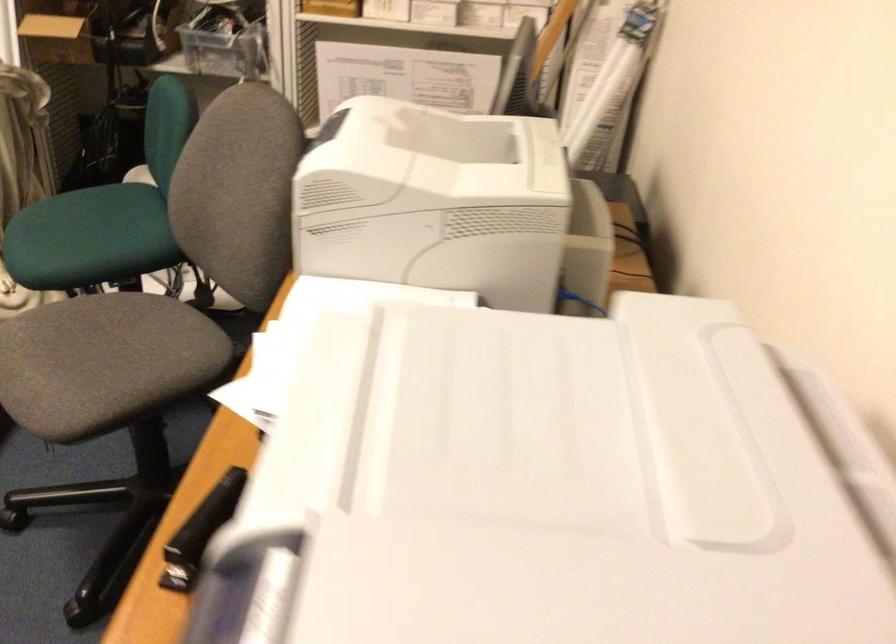
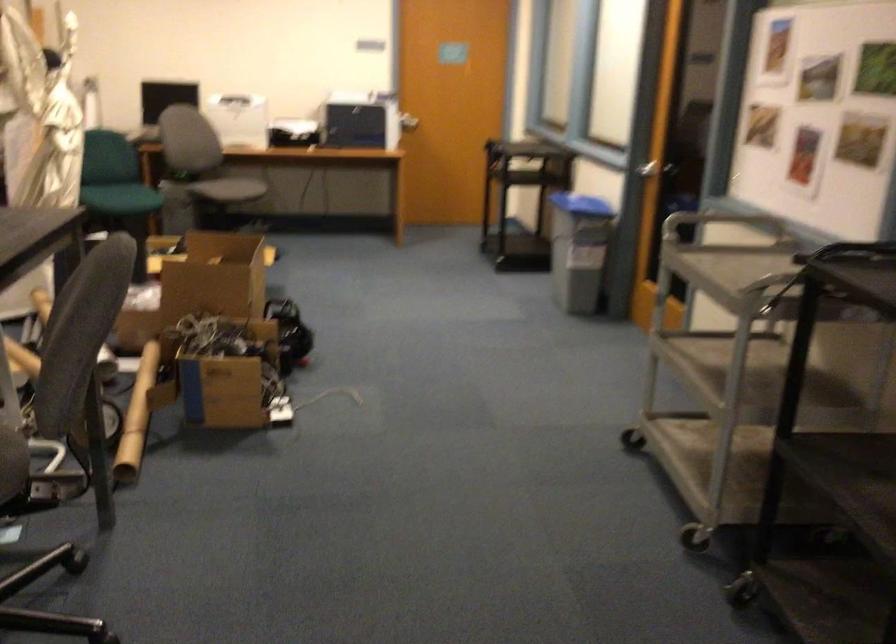
Question: I am providing you with two images of the same scene from different viewpoints. Please identify which objects are invisible in image2.

Choices:
 (A) blue trash can lid
 (B) grey bed mat
 (C) silver door handle
 (D) gray chair sitting surface

Answer: (D)